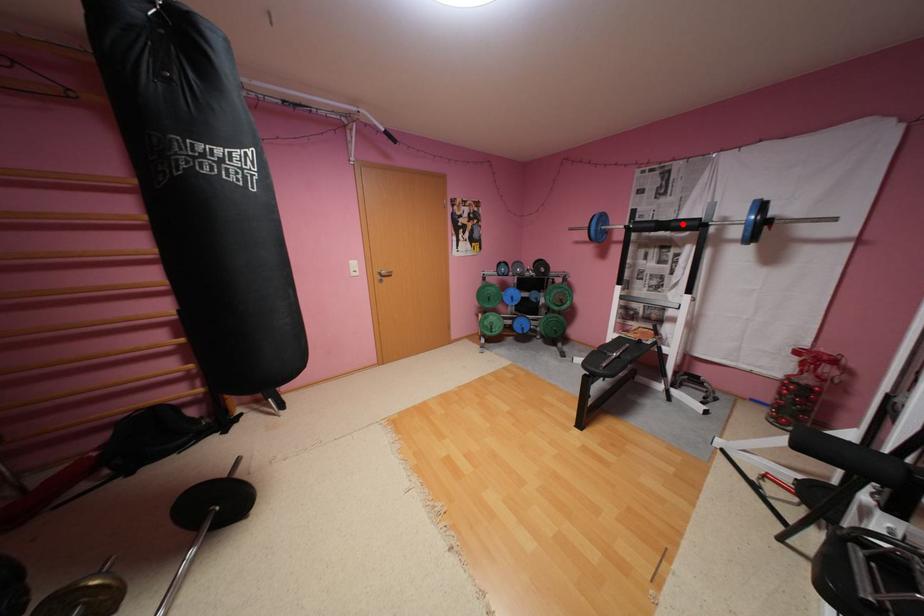
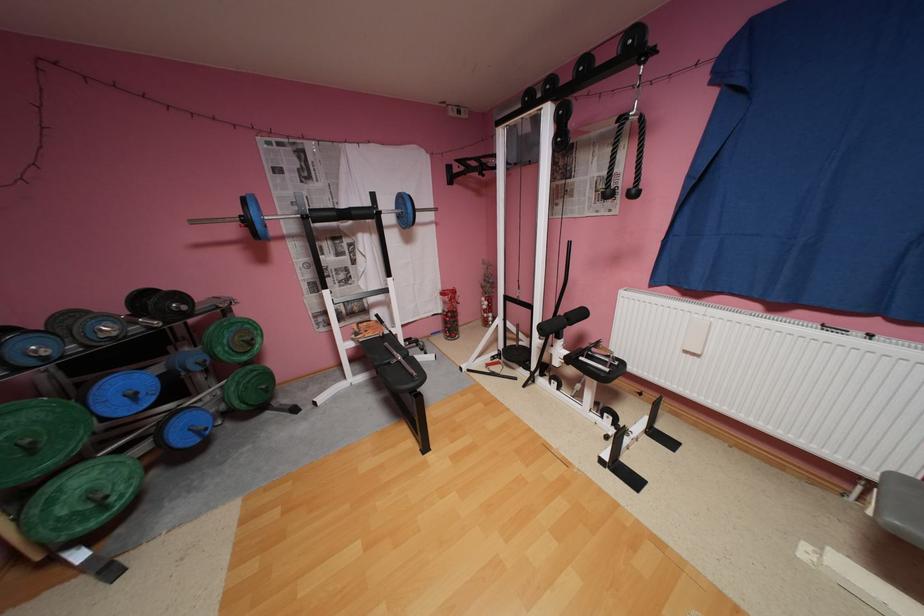
The point at the highlighted location is marked in the first image. Where is the corresponding point in the second image?

(362, 213)